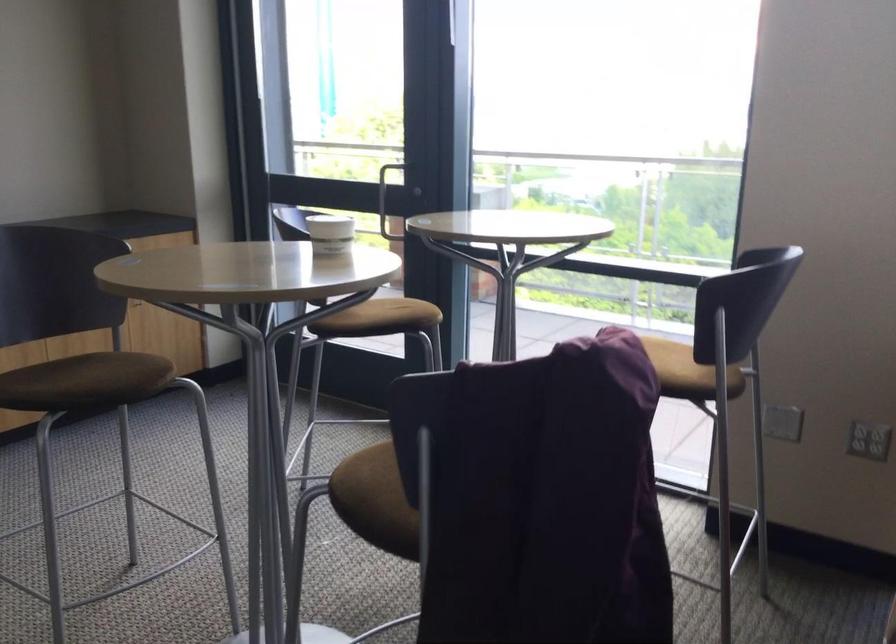
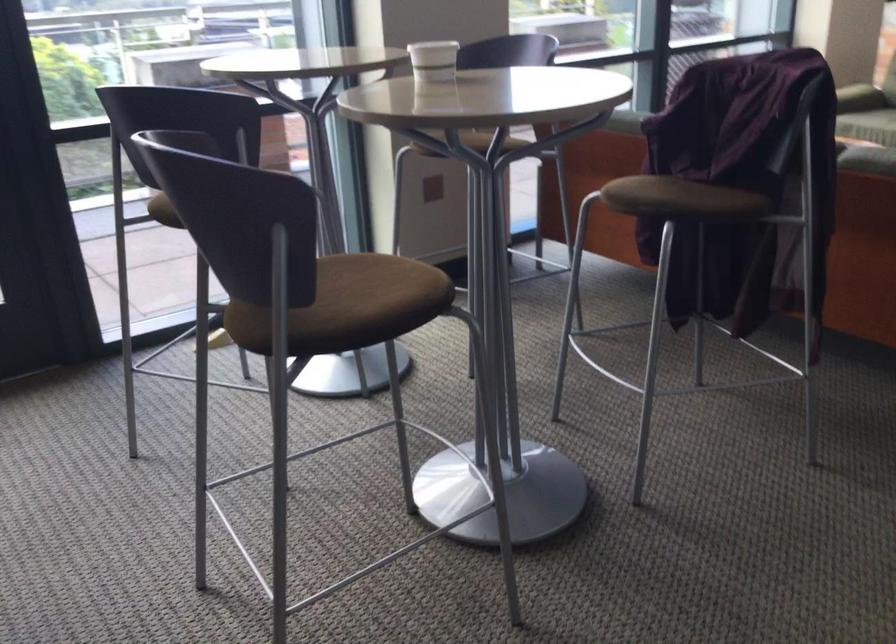
The point at (359, 471) is marked in the first image. Where is the corresponding point in the second image?

(666, 198)